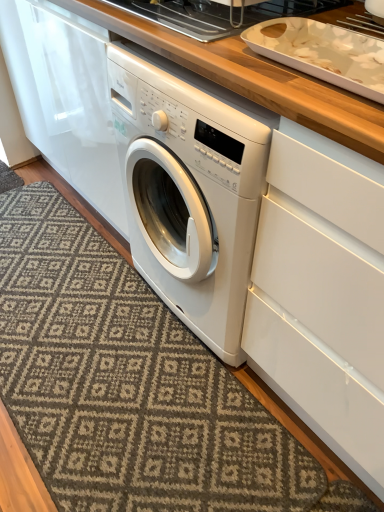
Question: Are patterned carpet at lower left and white glossy tray at upper center far apart?

Choices:
 (A) yes
 (B) no

Answer: (A)

Question: Can white glossy tray at upper center be found inside patterned carpet at lower left?

Choices:
 (A) yes
 (B) no

Answer: (B)

Question: Does patterned carpet at lower left have a greater width compared to white glossy tray at upper center?

Choices:
 (A) yes
 (B) no

Answer: (A)

Question: Is patterned carpet at lower left to the right of white glossy tray at upper center from the viewer's perspective?

Choices:
 (A) no
 (B) yes

Answer: (A)

Question: Does patterned carpet at lower left have a lesser width compared to white glossy tray at upper center?

Choices:
 (A) no
 (B) yes

Answer: (A)

Question: From a real-world perspective, is patterned carpet at lower left physically above white glossy tray at upper center?

Choices:
 (A) yes
 (B) no

Answer: (B)

Question: Is white glossy tray at upper center shorter than patterned carpet at lower left?

Choices:
 (A) no
 (B) yes

Answer: (A)

Question: Is white glossy tray at upper center further to the viewer compared to patterned carpet at lower left?

Choices:
 (A) yes
 (B) no

Answer: (A)

Question: Is white glossy tray at upper center turned away from patterned carpet at lower left?

Choices:
 (A) yes
 (B) no

Answer: (B)

Question: Is the surface of white glossy tray at upper center in direct contact with patterned carpet at lower left?

Choices:
 (A) no
 (B) yes

Answer: (A)

Question: Is white glossy tray at upper center completely or partially outside of patterned carpet at lower left?

Choices:
 (A) no
 (B) yes

Answer: (B)

Question: Considering the relative positions of white glossy tray at upper center and patterned carpet at lower left in the image provided, is white glossy tray at upper center to the left of patterned carpet at lower left from the viewer's perspective?

Choices:
 (A) yes
 (B) no

Answer: (B)

Question: Is white glossy tray at upper right bigger than white glossy tray at upper center?

Choices:
 (A) no
 (B) yes

Answer: (A)